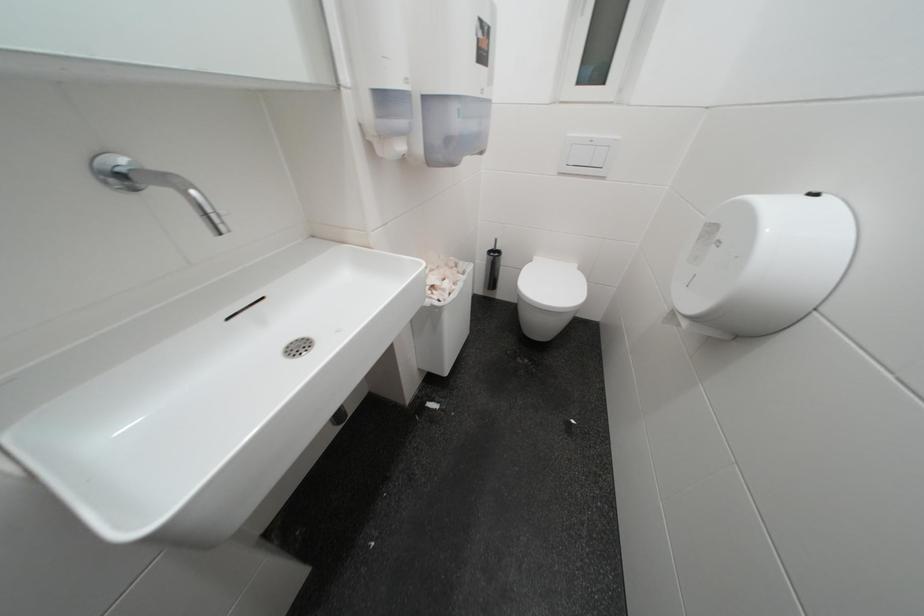
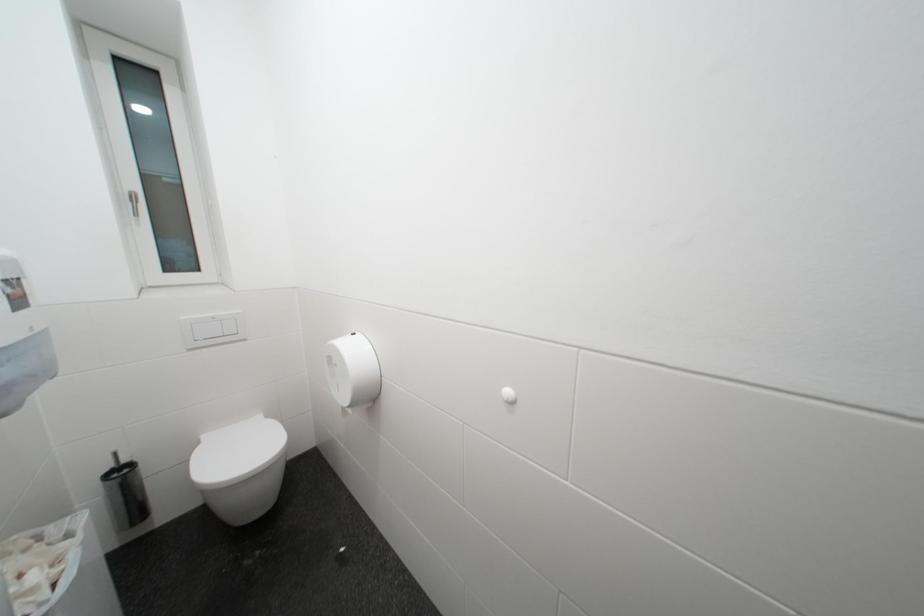
Question: The first image is from the beginning of the video and the second image is from the end. How did the camera likely rotate when shooting the video?

Choices:
 (A) Left
 (B) Right
 (C) Up
 (D) Down

Answer: (B)